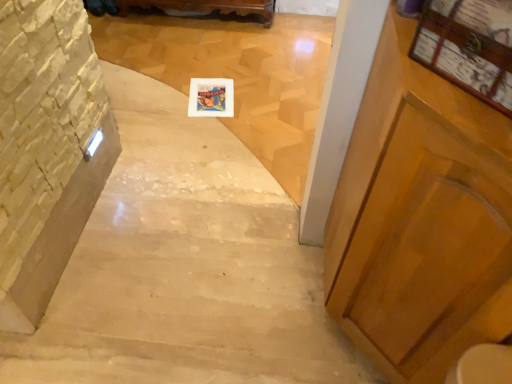
This screenshot has width=512, height=384. Describe the element at coordinates (236, 73) in the screenshot. I see `white marble stairs at center, the 1th stairwell in the right-to-left sequence` at that location.

I want to click on white marble stairs at center, which is the second stairwell in left-to-right order, so click(x=236, y=73).

From the image's perspective, which one is positioned higher, wooden frame at upper right or white marble stairs at center, the 1th stairwell in the right-to-left sequence?

From the image's view, white marble stairs at center, the 1th stairwell in the right-to-left sequence, is above.

In the image, is wooden frame at upper right positioned in front of or behind white marble stairs at center, the 1th stairwell in the right-to-left sequence?

In the image, wooden frame at upper right appears in front of white marble stairs at center, the 1th stairwell in the right-to-left sequence.

Can you confirm if wooden frame at upper right is taller than white marble stairs at center, which is the second stairwell in left-to-right order?

Yes.

Is point (227, 96) closer or farther from the camera than point (11, 330)?

Point (227, 96) is farther from the camera than point (11, 330).

From the image's perspective, is wooden frame at center beneath stone textured wall at left, positioned as the first stairwell in left-to-right order?

No.

Between wooden frame at center and stone textured wall at left, positioned as the first stairwell in left-to-right order, which one has more height?

stone textured wall at left, positioned as the first stairwell in left-to-right order.

Is wooden frame at center oriented away from stone textured wall at left, positioned as the first stairwell in left-to-right order?

No.

In the scene shown: Considering the sizes of objects wooden frame at center and wooden carved bench at upper center in the image provided, who is shorter, wooden frame at center or wooden carved bench at upper center?

With less height is wooden frame at center.

Does wooden frame at center touch wooden carved bench at upper center?

wooden frame at center is not next to wooden carved bench at upper center, and they're not touching.

Can you confirm if wooden frame at center is smaller than wooden carved bench at upper center?

Indeed, wooden frame at center has a smaller size compared to wooden carved bench at upper center.

Which is in front, point (325, 61) or point (58, 2)?

Point (58, 2)

From a real-world perspective, is white marble stairs at center, the 1th stairwell in the right-to-left sequence, beneath stone textured wall at left, positioned as the first stairwell in left-to-right order?

Correct, in the physical world, white marble stairs at center, the 1th stairwell in the right-to-left sequence, is lower than stone textured wall at left, positioned as the first stairwell in left-to-right order.

This screenshot has height=384, width=512. What are the coordinates of `stairwell located behind the stone textured wall at left, positioned as the first stairwell in left-to-right order` in the screenshot? It's located at (236, 73).

Is point (124, 8) closer to viewer compared to point (426, 49)?

That is False.

Does wooden carved bench at upper center appear on the left side of wooden frame at upper right?

Correct, you'll find wooden carved bench at upper center to the left of wooden frame at upper right.

The height and width of the screenshot is (384, 512). Identify the location of bulletin board below the wooden carved bench at upper center (from the image's perspective). (469, 47).

Is wooden frame at upper right far from wooden carved bench at upper center?

That's right, there is a large distance between wooden frame at upper right and wooden carved bench at upper center.

Is wooden frame at upper right positioned beyond the bounds of wooden carved bench at upper center?

Indeed, wooden frame at upper right is completely outside wooden carved bench at upper center.

Considering the sizes of wooden frame at upper right and wooden carved bench at upper center in the image, is wooden frame at upper right taller or shorter than wooden carved bench at upper center?

wooden frame at upper right is shorter than wooden carved bench at upper center.

Is wooden frame at upper right closer to camera compared to wooden carved bench at upper center?

Yes, the depth of wooden frame at upper right is less than that of wooden carved bench at upper center.

Is there a large distance between wooden carved bench at upper center and stone textured wall at left, positioned as the first stairwell in left-to-right order?

Yes, wooden carved bench at upper center and stone textured wall at left, positioned as the first stairwell in left-to-right order, are quite far apart.

Is wooden carved bench at upper center at the right side of stone textured wall at left, positioned as the first stairwell in left-to-right order?

Indeed, wooden carved bench at upper center is positioned on the right side of stone textured wall at left, positioned as the first stairwell in left-to-right order.

Measure the distance between wooden carved bench at upper center and stone textured wall at left, the 2th stairwell from the right.

wooden carved bench at upper center and stone textured wall at left, the 2th stairwell from the right, are 1.47 meters apart from each other.

Is point (183, 5) closer or farther from the camera than point (77, 182)?

Point (183, 5) is positioned farther from the camera compared to point (77, 182).

Identify the location of stairwell that is the 2nd object directly below the wooden frame at upper right (from a real-world perspective). (236, 73).

Find the location of a particular element. stairwell that is the 2nd one above the wooden frame at center (from a real-world perspective) is located at coordinates (46, 149).

Estimate the real-world distances between objects in this image. Which object is further from white marble stairs at center, the 1th stairwell in the right-to-left sequence, wooden carved bench at upper center or wooden frame at upper right?

Among the two, wooden frame at upper right is located further to white marble stairs at center, the 1th stairwell in the right-to-left sequence.

Estimate the real-world distances between objects in this image. Which object is further from stone textured wall at left, positioned as the first stairwell in left-to-right order, wooden carved bench at upper center or wooden frame at center?

wooden carved bench at upper center lies further to stone textured wall at left, positioned as the first stairwell in left-to-right order, than the other object.

Consider the image. From the image, which object appears to be farther from stone textured wall at left, positioned as the first stairwell in left-to-right order, wooden frame at upper right or white marble stairs at center, which is the second stairwell in left-to-right order?

Based on the image, wooden frame at upper right appears to be further to stone textured wall at left, positioned as the first stairwell in left-to-right order.

Based on their spatial positions, is white marble stairs at center, the 1th stairwell in the right-to-left sequence, or wooden frame at upper right further from stone textured wall at left, the 2th stairwell from the right?

wooden frame at upper right.

Considering their positions, is wooden carved bench at upper center positioned further to wooden frame at upper right than wooden frame at center?

wooden carved bench at upper center lies further to wooden frame at upper right than the other object.

Looking at the image, which one is located further to wooden frame at center, stone textured wall at left, positioned as the first stairwell in left-to-right order, or wooden carved bench at upper center?

stone textured wall at left, positioned as the first stairwell in left-to-right order, is positioned further to the anchor wooden frame at center.

Considering their positions, is wooden frame at upper right positioned further to wooden carved bench at upper center than white marble stairs at center, which is the second stairwell in left-to-right order?

Among the two, wooden frame at upper right is located further to wooden carved bench at upper center.

Based on their spatial positions, is wooden frame at upper right or stone textured wall at left, positioned as the first stairwell in left-to-right order, closer to white marble stairs at center, which is the second stairwell in left-to-right order?

stone textured wall at left, positioned as the first stairwell in left-to-right order, is positioned closer to the anchor white marble stairs at center, which is the second stairwell in left-to-right order.

The width and height of the screenshot is (512, 384). I want to click on picture frame between wooden carved bench at upper center and stone textured wall at left, the 2th stairwell from the right, in the up-down direction, so click(211, 97).

Where is `picture frame between white marble stairs at center, which is the second stairwell in left-to-right order, and wooden carved bench at upper center from front to back`? Image resolution: width=512 pixels, height=384 pixels. picture frame between white marble stairs at center, which is the second stairwell in left-to-right order, and wooden carved bench at upper center from front to back is located at coordinates (211, 97).

Image resolution: width=512 pixels, height=384 pixels. I want to click on stairwell situated between stone textured wall at left, the 2th stairwell from the right, and wooden frame at upper right from left to right, so click(x=236, y=73).

This screenshot has height=384, width=512. Find the location of `stairwell positioned between stone textured wall at left, positioned as the first stairwell in left-to-right order, and wooden frame at center from near to far`. stairwell positioned between stone textured wall at left, positioned as the first stairwell in left-to-right order, and wooden frame at center from near to far is located at coordinates (236, 73).